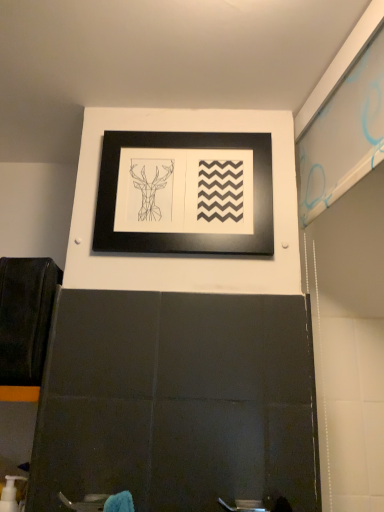
Question: Considering the positions of white plastic pump at lower left and black matte picture frame at upper center in the image, is white plastic pump at lower left taller or shorter than black matte picture frame at upper center?

Choices:
 (A) tall
 (B) short

Answer: (B)

Question: Is white plastic pump at lower left in front of or behind black matte picture frame at upper center in the image?

Choices:
 (A) front
 (B) behind

Answer: (A)

Question: Is white plastic pump at lower left situated inside black matte picture frame at upper center or outside?

Choices:
 (A) inside
 (B) outside

Answer: (B)

Question: From a real-world perspective, is black matte picture frame at upper center positioned above or below white plastic pump at lower left?

Choices:
 (A) below
 (B) above

Answer: (B)

Question: Considering the positions of black matte picture frame at upper center and white plastic pump at lower left in the image, is black matte picture frame at upper center taller or shorter than white plastic pump at lower left?

Choices:
 (A) tall
 (B) short

Answer: (A)

Question: Considering the relative positions of black matte picture frame at upper center and white plastic pump at lower left in the image provided, is black matte picture frame at upper center to the left or to the right of white plastic pump at lower left?

Choices:
 (A) left
 (B) right

Answer: (B)

Question: Based on their sizes in the image, would you say black matte picture frame at upper center is bigger or smaller than white plastic pump at lower left?

Choices:
 (A) big
 (B) small

Answer: (A)